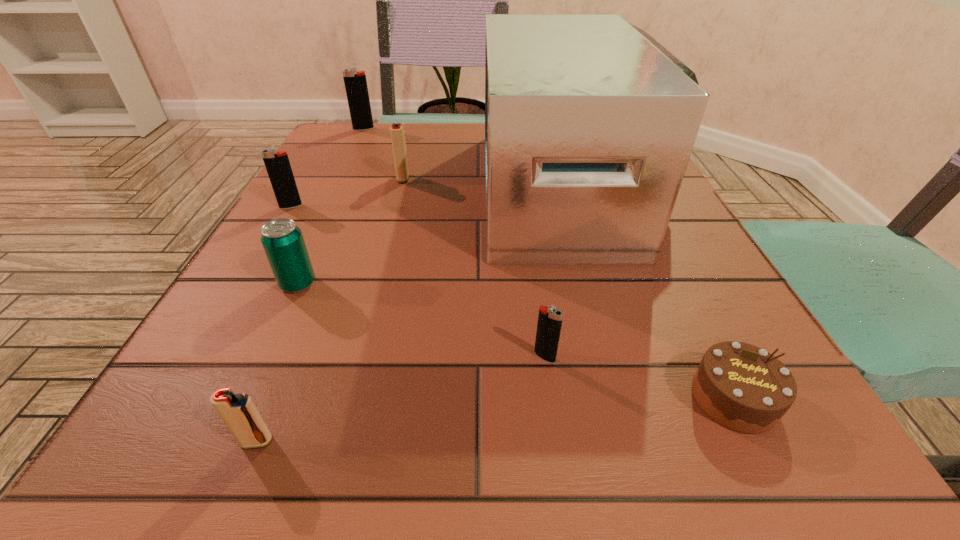
This screenshot has height=540, width=960. I want to click on beer can situated at the left edge, so click(x=283, y=242).

The width and height of the screenshot is (960, 540). I want to click on microwave oven that is positioned at the right edge, so click(x=590, y=122).

In order to click on chocolate cake located at the right edge in this screenshot , I will do `click(742, 387)`.

You are a GUI agent. You are given a task and a screenshot of the screen. Output one action in this format:
    pyautogui.click(x=<x>, y=<y>)
    Task: Click on the object at the far left corner
    This screenshot has height=540, width=960.
    Given the screenshot: What is the action you would take?
    (x=356, y=87)

The height and width of the screenshot is (540, 960). I want to click on object that is at the near left corner, so click(x=239, y=413).

Identify the location of object present at the far right corner. (590, 122).

Find the location of `object at the near right corner`. object at the near right corner is located at coordinates (742, 387).

What are the coordinates of `blank space at the far edge of the desktop` in the screenshot? It's located at (452, 161).

I want to click on free space at the near edge of the desktop, so click(x=427, y=447).

In the image, there is a desktop. At what (x,y) coordinates should I click in order to perform the action: click on vacant space at the left edge. Please return your answer as a coordinate pair (x, y). This screenshot has height=540, width=960. Looking at the image, I should click on (x=358, y=203).